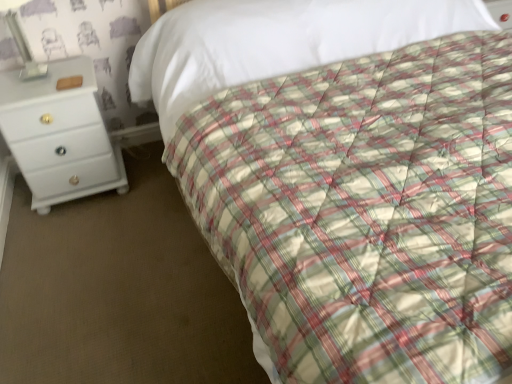
Where is `vacant region below metallic silver lamp at upper left (from a real-world perspective)`? This screenshot has width=512, height=384. vacant region below metallic silver lamp at upper left (from a real-world perspective) is located at coordinates (37, 74).